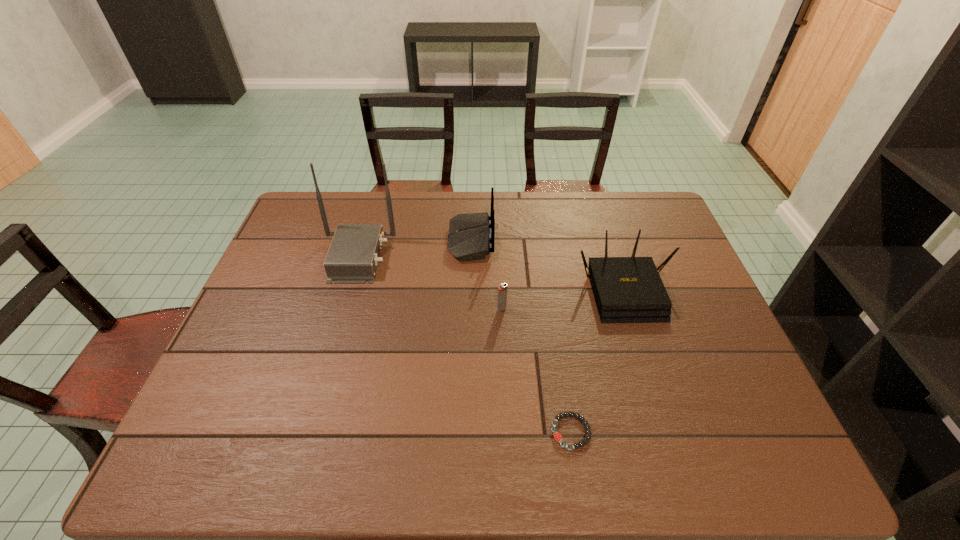
In the image, there is a desktop. Where is `blank space at the near edge`? The width and height of the screenshot is (960, 540). blank space at the near edge is located at coordinates (515, 439).

This screenshot has width=960, height=540. In the image, there is a desktop. Find the location of `vacant space at the left edge`. vacant space at the left edge is located at coordinates 214,394.

In the image, there is a desktop. Where is `vacant area at the right edge`? The image size is (960, 540). vacant area at the right edge is located at coordinates (706, 386).

Locate an element on the screen. This screenshot has height=540, width=960. vacant region at the near right corner of the desktop is located at coordinates (752, 458).

Locate an element on the screen. empty location between the bracelet and the shortest router is located at coordinates (598, 361).

This screenshot has width=960, height=540. What are the coordinates of `unoccupied position between the igniter and the fourth object from left to right` in the screenshot? It's located at (536, 370).

Locate an element on the screen. The height and width of the screenshot is (540, 960). vacant point located between the fourth object from right to left and the leftmost object is located at coordinates (414, 248).

At what (x,y) coordinates should I click in order to perform the action: click on vacant point located between the igniter and the fourth shortest object. Please return your answer as a coordinate pair (x, y). Looking at the image, I should click on (486, 274).

Where is `vacant point located between the leftmost router and the rightmost object`? The height and width of the screenshot is (540, 960). vacant point located between the leftmost router and the rightmost object is located at coordinates (492, 273).

Locate an element on the screen. Image resolution: width=960 pixels, height=540 pixels. vacant area between the nearest object and the leftmost router is located at coordinates (464, 345).